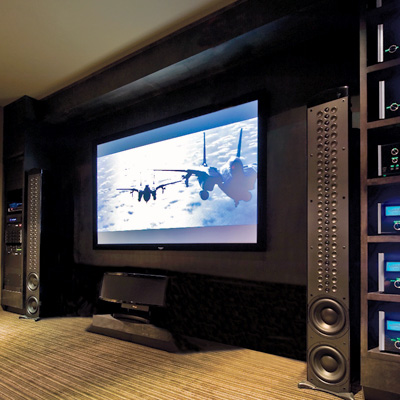
Where is `monitor stand`? This screenshot has width=400, height=400. monitor stand is located at coordinates (146, 332).